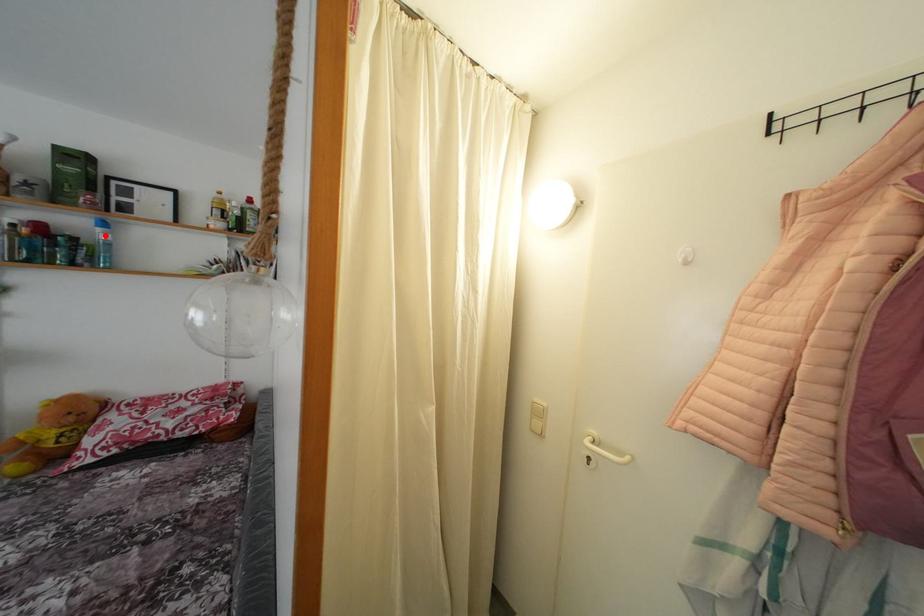
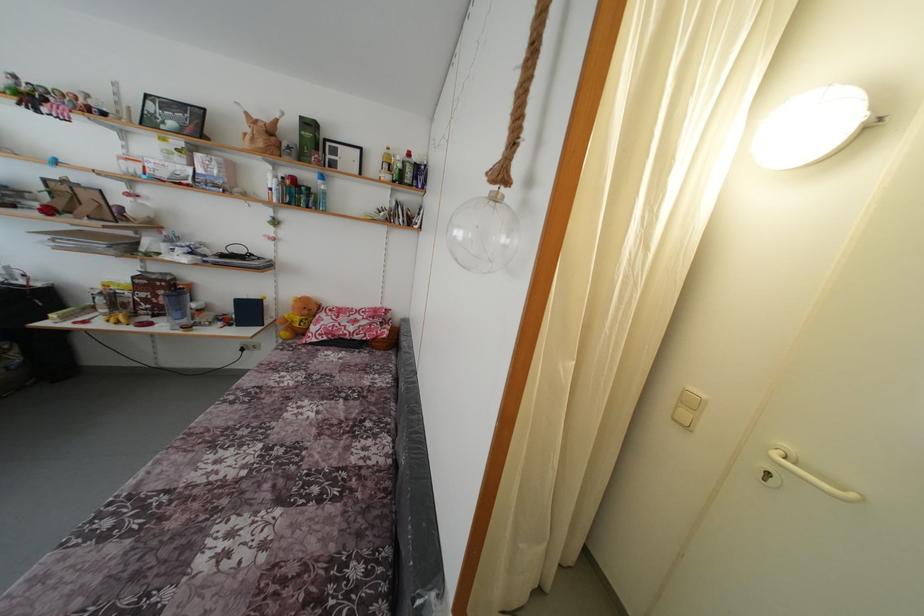
Locate, in the second image, the point that corresponds to the highlighted location in the first image.

(324, 188)